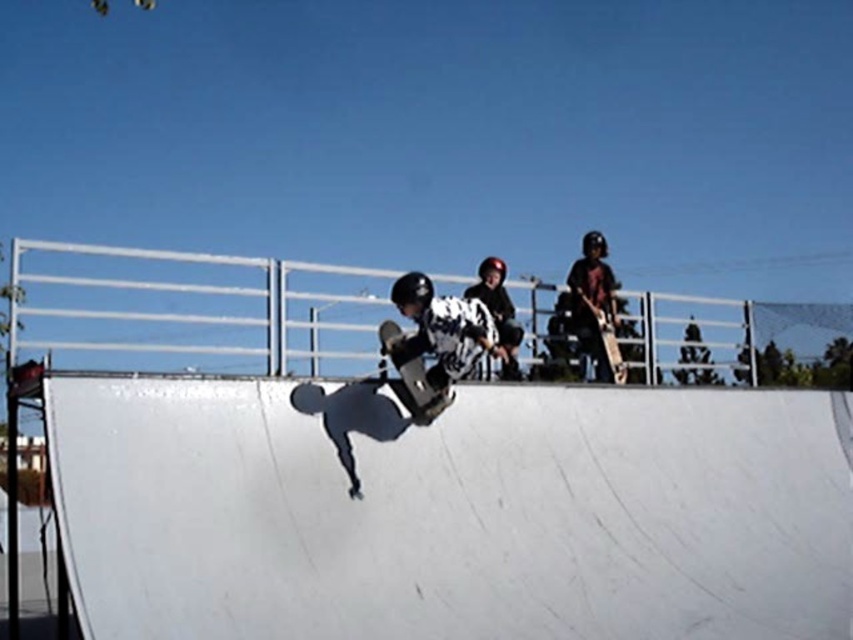
Where is `matte black skateboard at center`? This screenshot has width=853, height=640. matte black skateboard at center is located at coordinates (434, 342).

Is matte black skateboard at center to the right of dark gray helmet at upper right from the viewer's perspective?

No, matte black skateboard at center is not to the right of dark gray helmet at upper right.

Is point (418, 310) closer to viewer compared to point (614, 305)?

Yes, it is.

You are a GUI agent. You are given a task and a screenshot of the screen. Output one action in this format:
    pyautogui.click(x=<x>, y=<y>)
    Task: Click on the matte black skateboard at center
    The image size is (853, 640).
    Given the screenshot: What is the action you would take?
    pyautogui.click(x=434, y=342)

Consider the image. Is dark gray helmet at upper right shorter than wooden skateboard at center?

No.

Between dark gray helmet at upper right and wooden skateboard at center, which one has less height?

wooden skateboard at center is shorter.

Locate an element on the screen. This screenshot has height=640, width=853. dark gray helmet at upper right is located at coordinates (593, 300).

This screenshot has height=640, width=853. Describe the element at coordinates (451, 512) in the screenshot. I see `white smooth ramp at center` at that location.

Is white smooth ramp at center taller than black matte skateboard at center?

Yes, white smooth ramp at center is taller than black matte skateboard at center.

Locate an element on the screen. The image size is (853, 640). white smooth ramp at center is located at coordinates (451, 512).